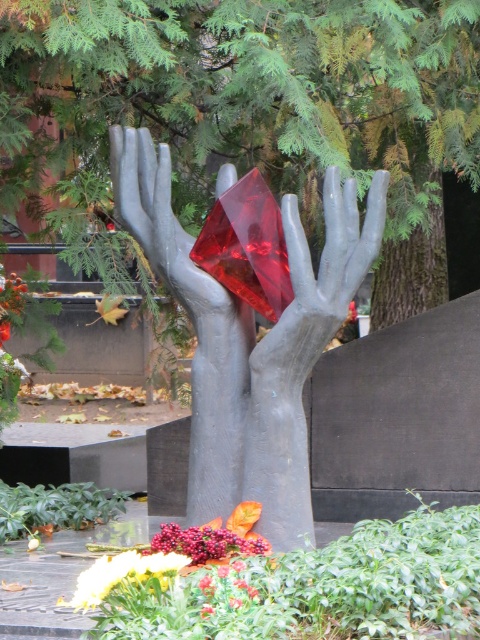
You are standing in the memorial area looking at the sculpture. There is a green leafy tree at center. Can you see the tree from the position of the point marked at coordinate (257, 100)?

Yes, the point at coordinate (257, 100) indicates the green leafy tree at center, so you are at the tree itself and can see it.